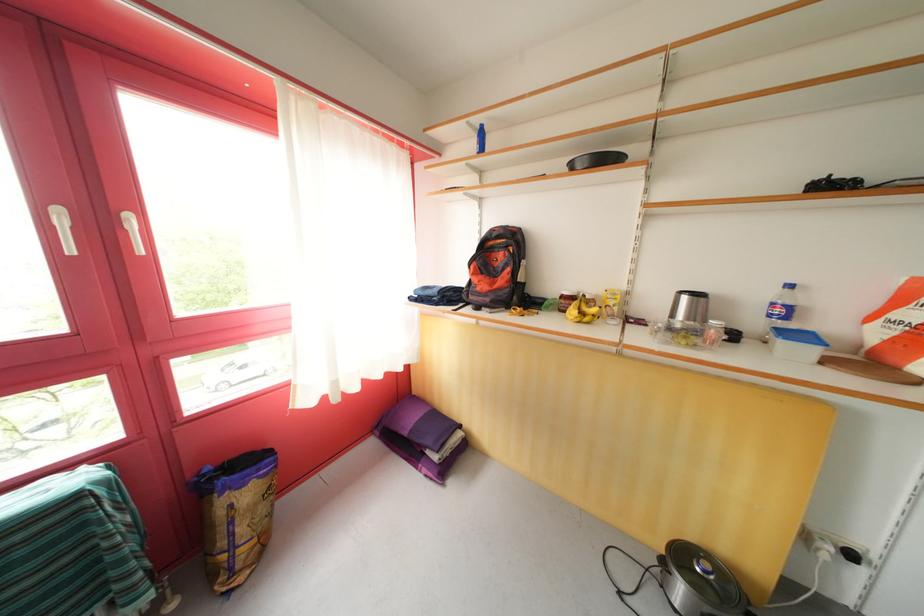
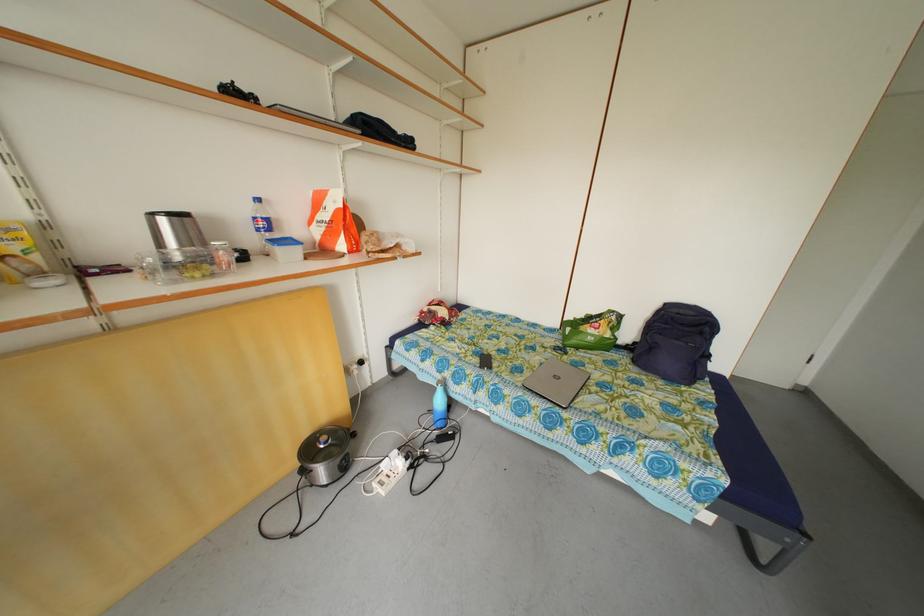
In the second image, find the point that corresponds to the point at 786,317 in the first image.

(270, 230)